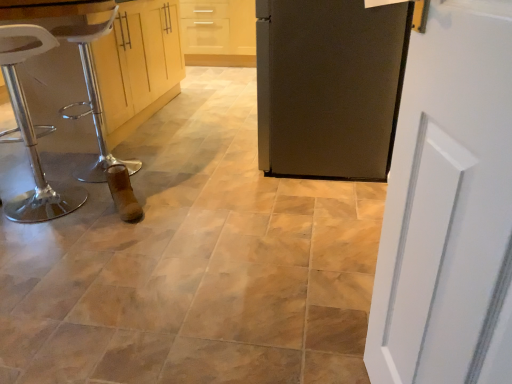
You are a GUI agent. You are given a task and a screenshot of the screen. Output one action in this format:
    pyautogui.click(x=<x>, y=<y>)
    Task: Click on the free space to the left of white plastic bar stool at left
    
    Given the screenshot: What is the action you would take?
    click(53, 168)